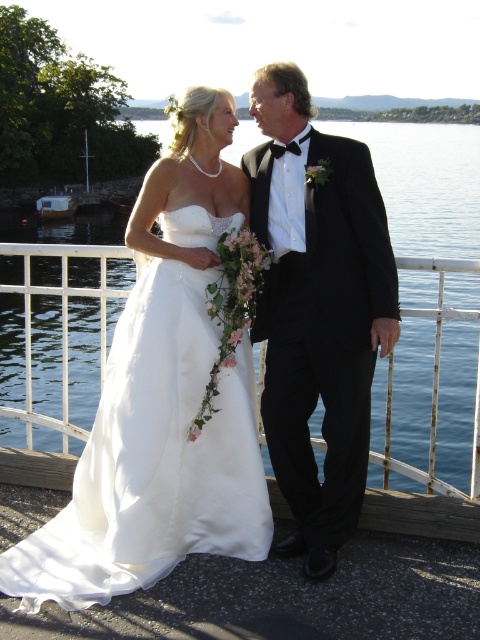
Question: Can you confirm if satin/sheen wedding dress at center is positioned below white metal railing at center?

Choices:
 (A) yes
 (B) no

Answer: (A)

Question: Which object is positioned farthest from the black satin tuxedo at center?

Choices:
 (A) white metal railing at center
 (B) satin/sheen wedding dress at center

Answer: (A)

Question: Is black satin tuxedo at center closer to camera compared to white metal railing at center?

Choices:
 (A) no
 (B) yes

Answer: (B)

Question: Is black satin tuxedo at center wider than white metal railing at center?

Choices:
 (A) yes
 (B) no

Answer: (B)

Question: Which point is farther from the camera taking this photo?

Choices:
 (A) (433, 452)
 (B) (342, 314)
 (C) (157, 422)

Answer: (A)

Question: Which point is farther to the camera?

Choices:
 (A) satin/sheen wedding dress at center
 (B) black satin tuxedo at center
 (C) white metal railing at center

Answer: (C)